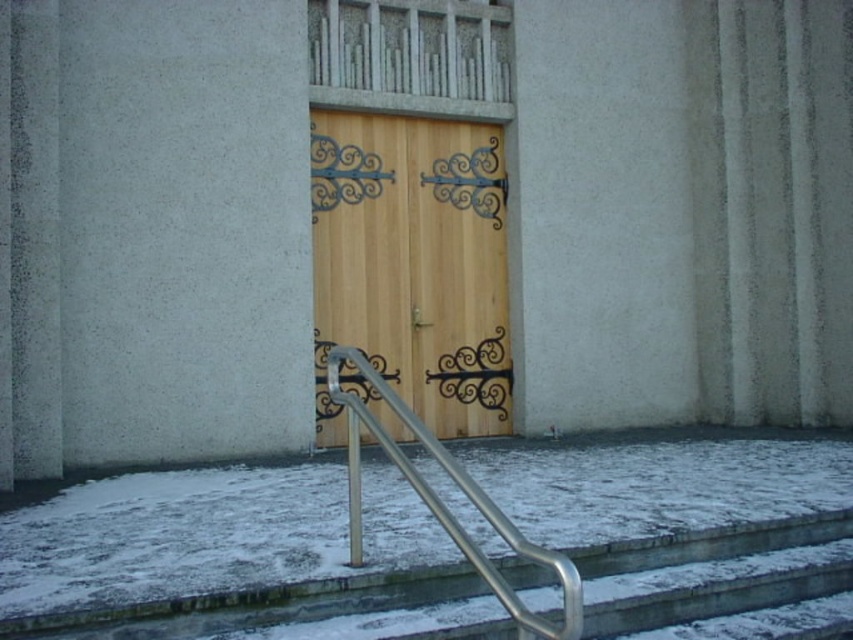
You are standing on the steps leading to the building and see the white powdery snow at lower center and the silver metallic handrail at lower center. Which object is closer to the ground?

The white powdery snow at lower center is below the silver metallic handrail at lower center, so it is closer to the ground.

You are a painter who needs to decide which object to paint first. The wooden door at center and the silver metallic handrail at lower center are both in your current view. Based on their sizes, which one should you tackle first if you want to start with the larger object?

The wooden door at center might be wider than silver metallic handrail at lower center, so you should paint the wooden door at center first since it is likely larger.